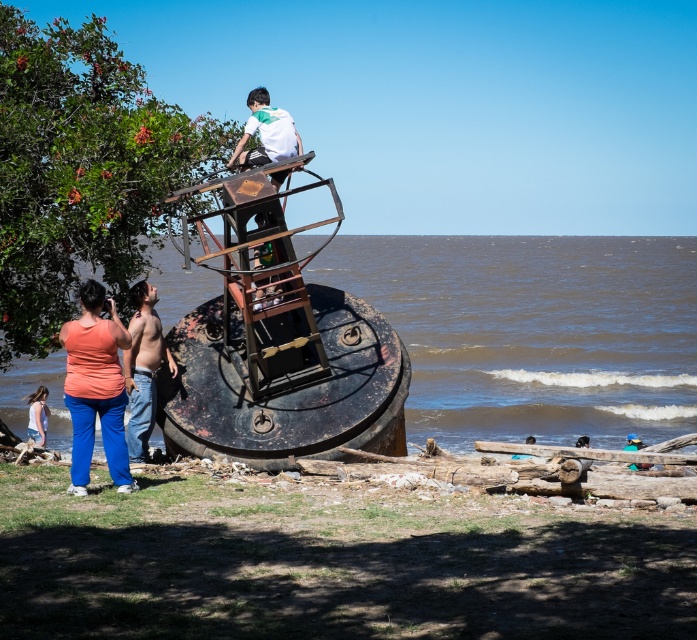
You are a photographer positioned at the center of the beach scene. You want to capture a photo that includes both the large rusted cylindrical object and the child climbing it. However, there is an obstruction at point (95,387). What object is blocking your shot?

The obstruction at point (95,387) is the matte orange tank top at lower left, which is blocking the shot.

Based on the photo, you are a photographer at the beach scene. You need to position a camera tripod such that it doesn not block the view of the two adults watching the child climb the structure. Given that the matte orange tank top at lower left and denim shorts at lower left are both in the lower left area, which object should you place the tripod closer to to avoid blocking their view?

The matte orange tank top at lower left is taller than denim shorts at lower left. To avoid blocking the view of the two adults, position the tripod closer to the denim shorts at lower left since it is shorter and less likely to obstruct the line of sight.

You are planning to place a picnic blanket between the large, rusted cylindrical object and the green leafy tree at upper left. The blanket is 3 meters wide. Can you fit it between them without overlapping either object?

The distance between the large, rusted cylindrical object and the green leafy tree at upper left is 25.11 meters, which is much greater than the 3 meter width of the picnic blanket. Yes, the blanket can easily be placed between them without overlapping either object.